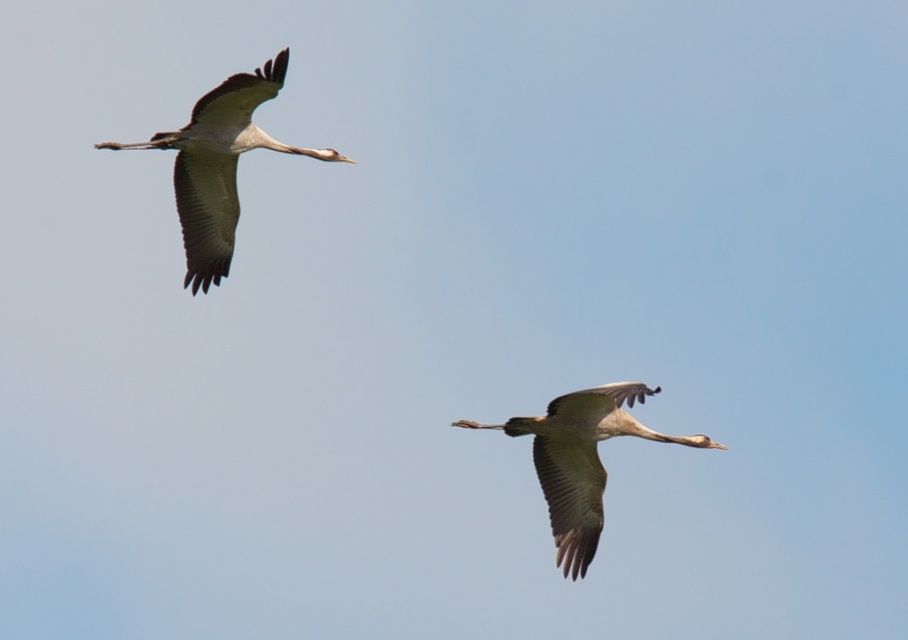
You are a birdwatcher observing two birds in the sky. You see the gray matte bird at upper left and the gray feathered crane at center. Which bird is closer to you?

The gray matte bird at upper left is closer to you because it is positioned further to the viewer than the gray feathered crane at center.

You are an ornithologist observing two birds in flight. You notice a gray matte bird at upper left and a gray feathered crane at center. Which bird has a greater height?

The gray matte bird at upper left is taller than the gray feathered crane at center according to the description.

You are an ornithologist studying bird flight patterns. You observe a gray matte bird at upper left in the image. Based on its position coordinates, can you determine if it is closer to the top edge or the left edge of the image?

The gray matte bird at upper left is positioned at coordinates point (x=218, y=164). Since the x and y values are both less than 0.5, it is closer to the top edge and left edge of the image. However, since the y coordinate is slightly smaller than the x coordinate, it is marginally closer to the top edge than the left edge.